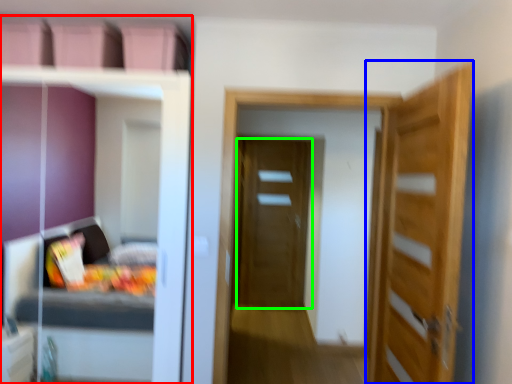
Question: Which object is the closest to the dresser (highlighted by a red box)? Choose among these: door (highlighted by a blue box) or door (highlighted by a green box).

Choices:
 (A) door
 (B) door

Answer: (A)